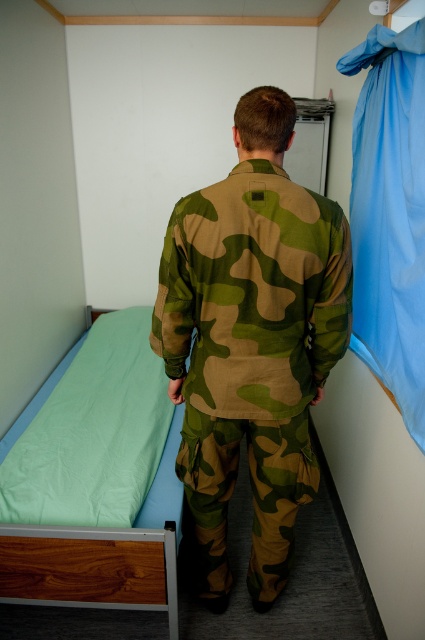
You are a tailor measuring clothing items in a room. You see the camouflage fabric uniform at center and the green fabric bed at left. Which item is taller?

Result: The camouflage fabric uniform at center is taller than the green fabric bed at left according to the description.

You are a photographer setting up a shoot in the room. You want to take a photo of the camouflage fabric uniform at center so that the green fabric bed at left is visible in the background. Is this possible given their positions?

Yes, the camouflage fabric uniform at center is in front of the green fabric bed at left, so the bed will be visible in the background of the photo.